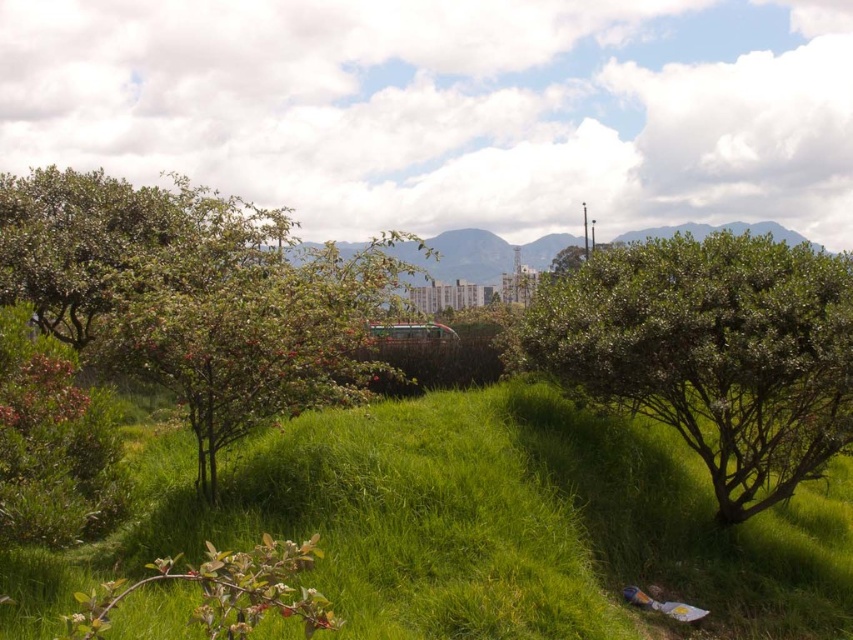
You are a gardener standing in the middle of the green grass at center. You want to water the green leafy bush at center. Can you reach the bush without stepping on the grass?

The green grass at center is positioned under the green leafy bush at center. Since the grass is under the bush, you can reach the bush without stepping on the grass by approaching from the side or around it.

You are a gardener who needs to mow the lawn. You see the green grass at center and the green leafy bush at left. Which area should you avoid mowing to prevent damaging the plants?

You should avoid mowing the green leafy bush at left because it is taller than the green grass at center, and mowing it could damage the bush.

You are standing at the center of the image and want to walk towards the green leafy bush at left. In which direction should you move?

Since the green leafy bush at left is located at point 0.464 on the x and 0.231 on the y coordinate, you should move towards the left direction to reach it.